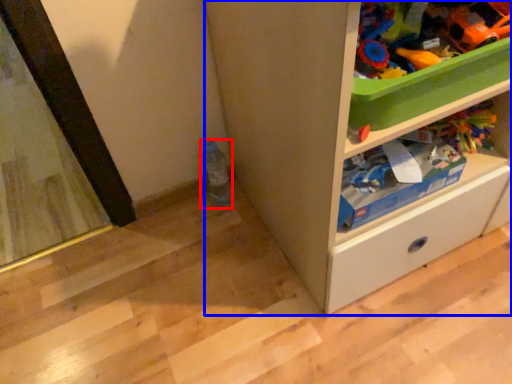
Question: Which object appears closest to the camera in this image, bottle (highlighted by a red box) or cabinetry (highlighted by a blue box)?

Choices:
 (A) bottle
 (B) cabinetry

Answer: (B)